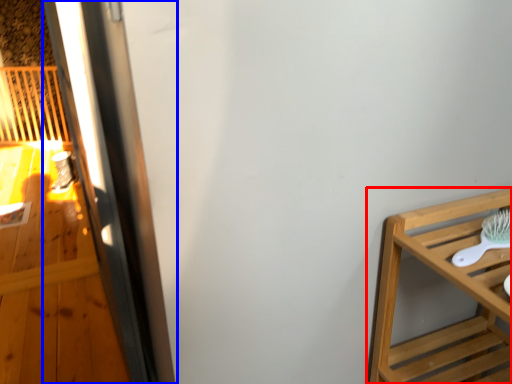
Question: Among these objects, which one is nearest to the camera, furniture (highlighted by a red box) or screen door (highlighted by a blue box)?

Choices:
 (A) furniture
 (B) screen door

Answer: (A)